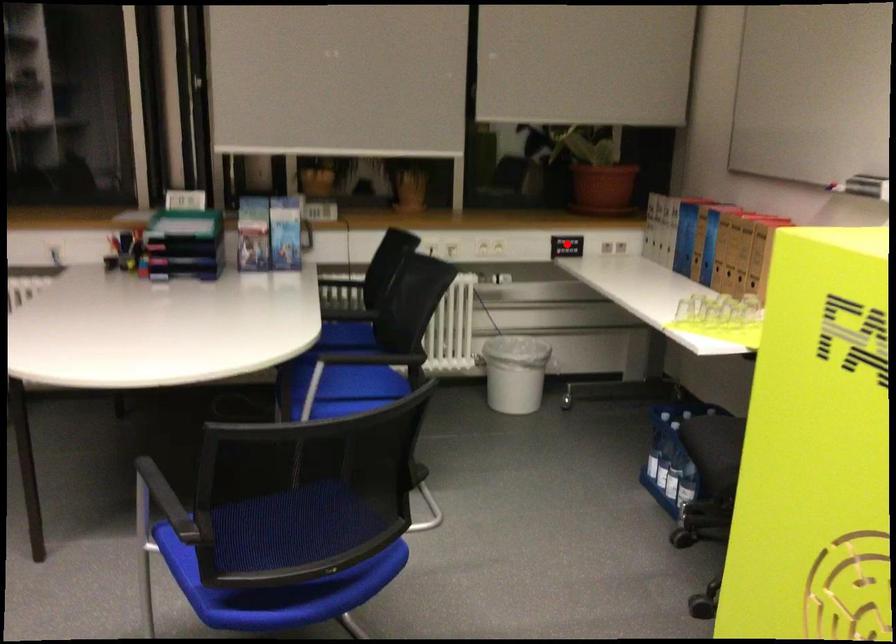
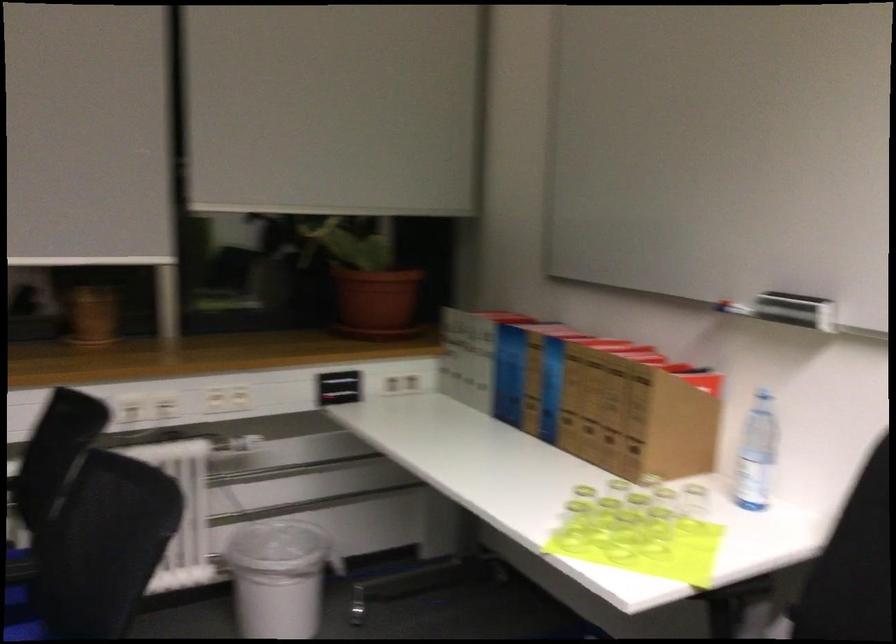
Question: A red point is marked in image1. In image2, is the corresponding 3D point closer to the camera or farther? Reply with the corresponding letter.

Choices:
 (A) The corresponding 3D point is closer.
 (B) The corresponding 3D point is farther.

Answer: (A)